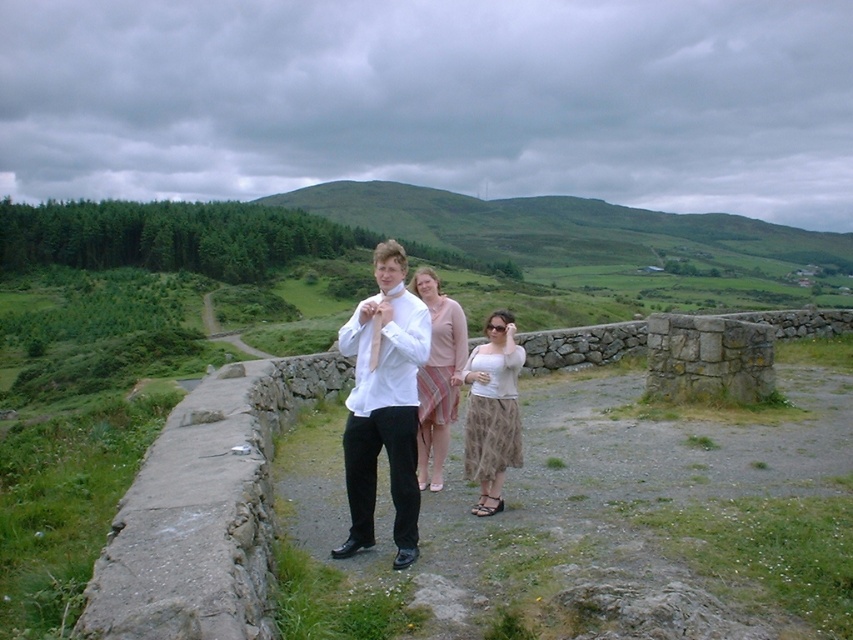
You are a photographer trying to capture a group photo of the matte white shirt at center and the pink striped skirt at center. Since you want to ensure both are clearly visible, which clothing item should you focus on first to account for their sizes?

The matte white shirt at center has a larger width than the pink striped skirt at center, so you should focus on the matte white shirt at center first to ensure its details are captured clearly.